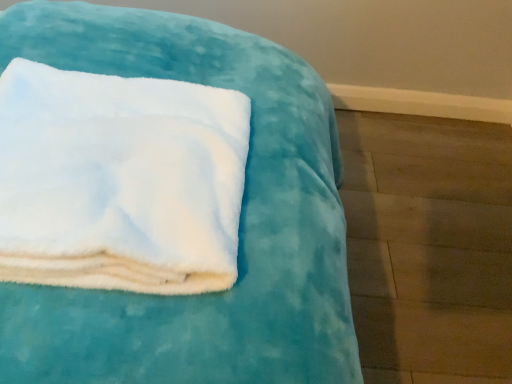
Question: Are white fluffy towel at upper left and white fluffy towel at upper left far apart?

Choices:
 (A) no
 (B) yes

Answer: (A)

Question: Does white fluffy towel at upper left have a larger size compared to white fluffy towel at upper left?

Choices:
 (A) yes
 (B) no

Answer: (A)

Question: Could you tell me if white fluffy towel at upper left is facing white fluffy towel at upper left?

Choices:
 (A) no
 (B) yes

Answer: (A)

Question: Considering the relative sizes of white fluffy towel at upper left and white fluffy towel at upper left in the image provided, is white fluffy towel at upper left shorter than white fluffy towel at upper left?

Choices:
 (A) no
 (B) yes

Answer: (B)

Question: Is white fluffy towel at upper left a part of white fluffy towel at upper left?

Choices:
 (A) yes
 (B) no

Answer: (B)

Question: Is white fluffy towel at upper left thinner than white fluffy towel at upper left?

Choices:
 (A) no
 (B) yes

Answer: (A)

Question: From a real-world perspective, is white fluffy towel at upper left located higher than white fluffy towel at upper left?

Choices:
 (A) yes
 (B) no

Answer: (A)

Question: Can you confirm if white fluffy towel at upper left is bigger than white fluffy towel at upper left?

Choices:
 (A) yes
 (B) no

Answer: (B)

Question: Is white fluffy towel at upper left smaller than white fluffy towel at upper left?

Choices:
 (A) no
 (B) yes

Answer: (B)

Question: Is there a large distance between white fluffy towel at upper left and white fluffy towel at upper left?

Choices:
 (A) yes
 (B) no

Answer: (B)

Question: Is the depth of white fluffy towel at upper left greater than that of white fluffy towel at upper left?

Choices:
 (A) yes
 (B) no

Answer: (B)

Question: From the image's perspective, does white fluffy towel at upper left appear lower than white fluffy towel at upper left?

Choices:
 (A) yes
 (B) no

Answer: (B)

Question: Considering their positions, is white fluffy towel at upper left located in front of or behind white fluffy towel at upper left?

Choices:
 (A) behind
 (B) front

Answer: (B)